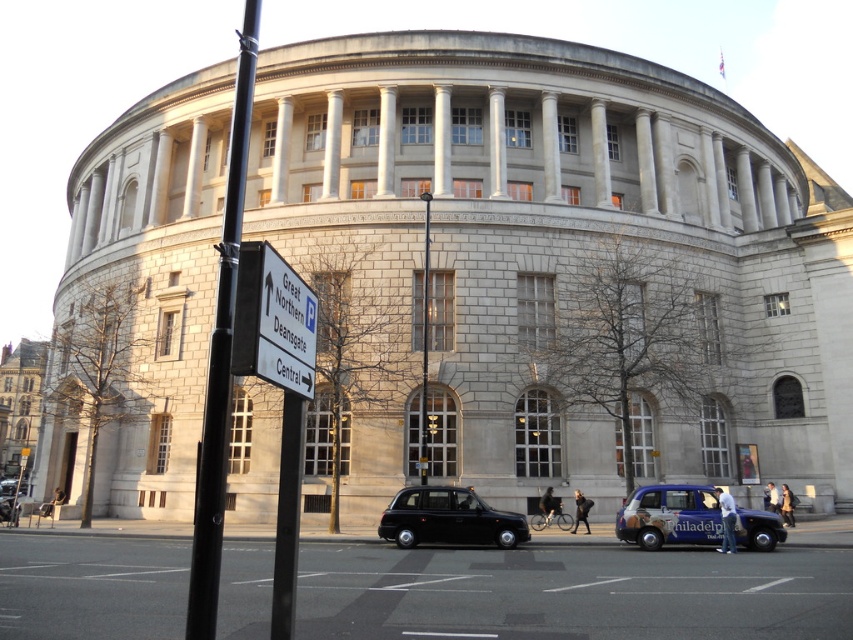
Can you confirm if white plastic sign at upper center is smaller than blue metallic taxi at lower center?

Indeed, white plastic sign at upper center has a smaller size compared to blue metallic taxi at lower center.

Which is in front, point (315, 320) or point (654, 500)?

Point (315, 320) is in front.

Where is `white plastic sign at upper center`? white plastic sign at upper center is located at coordinates (273, 321).

Is point (230, 316) positioned behind point (714, 506)?

No.

Is black metal pole at center thinner than blue metallic taxi at lower center?

→ No, black metal pole at center is not thinner than blue metallic taxi at lower center.

The width and height of the screenshot is (853, 640). In order to click on black metal pole at center in this screenshot , I will do `click(221, 355)`.

Does point (289, 292) lie in front of point (518, 525)?

Yes.

Who is positioned more to the right, white plastic sign at upper center or shiny black taxi at center?

shiny black taxi at center

Where is `white plastic sign at upper center`? The width and height of the screenshot is (853, 640). white plastic sign at upper center is located at coordinates (273, 321).

You are a GUI agent. You are given a task and a screenshot of the screen. Output one action in this format:
    pyautogui.click(x=<x>, y=<y>)
    Task: Click on the white plastic sign at upper center
    
    Given the screenshot: What is the action you would take?
    pyautogui.click(x=273, y=321)